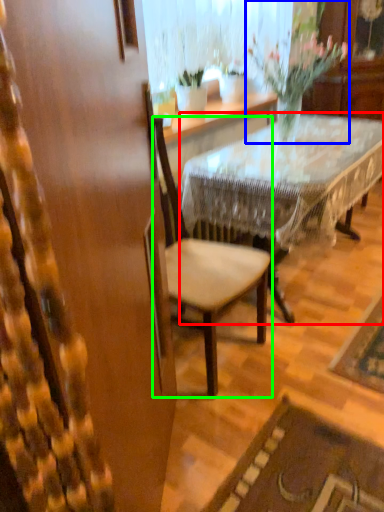
Question: Estimate the real-world distances between objects in this image. Which object is farther from desk (highlighted by a red box), houseplant (highlighted by a blue box) or chair (highlighted by a green box)?

Choices:
 (A) houseplant
 (B) chair

Answer: (A)